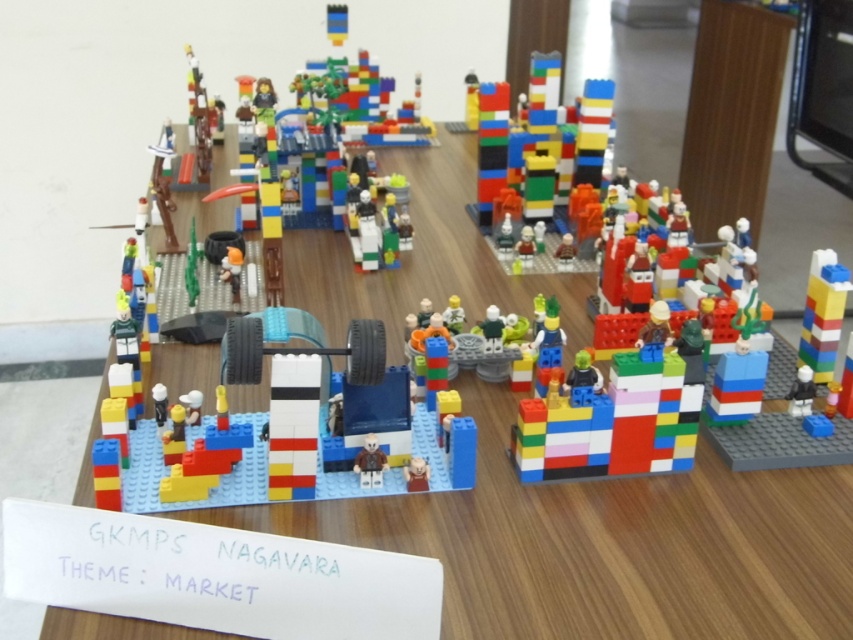
You are a LEGO figure trying to reach the top of the smooth blue brick wall at center. You are currently standing on the matte brown minifigure at center. Can you climb onto the wall from here?

The smooth blue brick wall at center is located above the matte brown minifigure at center, so yes, you can climb onto the wall from there since it is positioned above you.

In the LEGO market diorama, you need to place a new LEGO figure that is the same size as the matte brown minifigure at center. Where can you place it so that it fits next to the smooth blue brick wall at center without overlapping?

Since the smooth blue brick wall at center is wider than the matte brown minifigure at center, you can place the new figure next to the matte brown minifigure at center along the wall, ensuring there is enough space between them as the wall is wider than the minifigure.